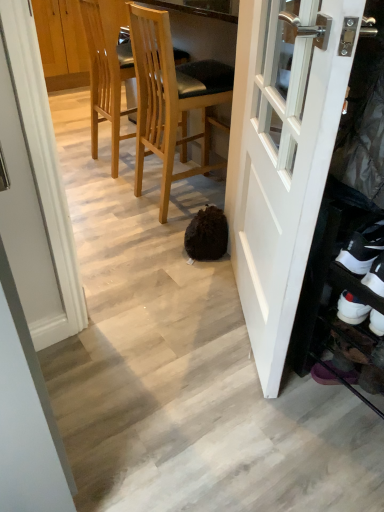
Image resolution: width=384 pixels, height=512 pixels. What are the coordinates of `free space to the left of light brown wood chair at center, which ranks as the 2th chair in right-to-left order` in the screenshot? It's located at (80, 157).